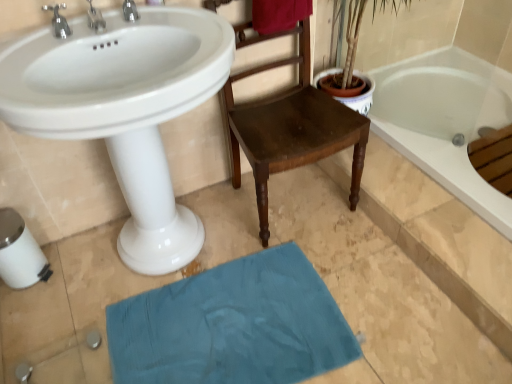
Where is `free space above teal fabric bath mat at lower center (from a real-world perspective)`? free space above teal fabric bath mat at lower center (from a real-world perspective) is located at coordinates (226, 326).